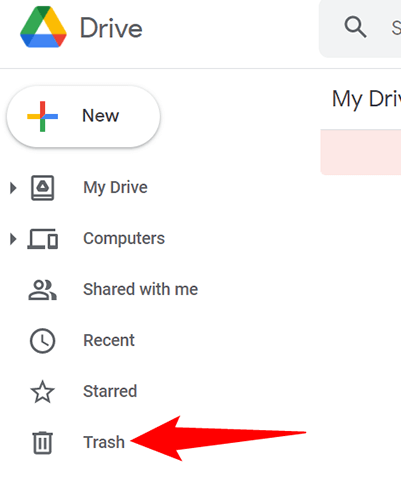
Identify the location of screen. The image size is (401, 477). (39, 238), (53, 241).